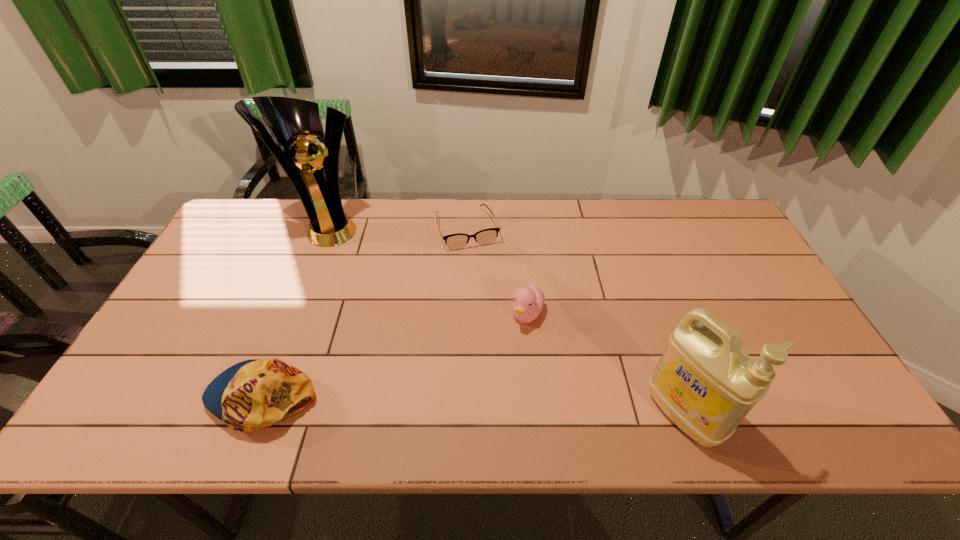
Locate an element on the screen. the closest object to the cap is located at coordinates click(294, 123).

Identify which object is the nearest to the rightmost object. Please provide its 2D coordinates. Your answer should be formatted as a tuple, i.e. [(x, y)], where the tuple contains the x and y coordinates of a point satisfying the conditions above.

[(528, 302)]

Locate an element on the screen. The height and width of the screenshot is (540, 960). vacant position in the image that satisfies the following two spatial constraints: 1. on the front side of the tallest object; 2. on the left side of the second tallest object is located at coordinates (255, 414).